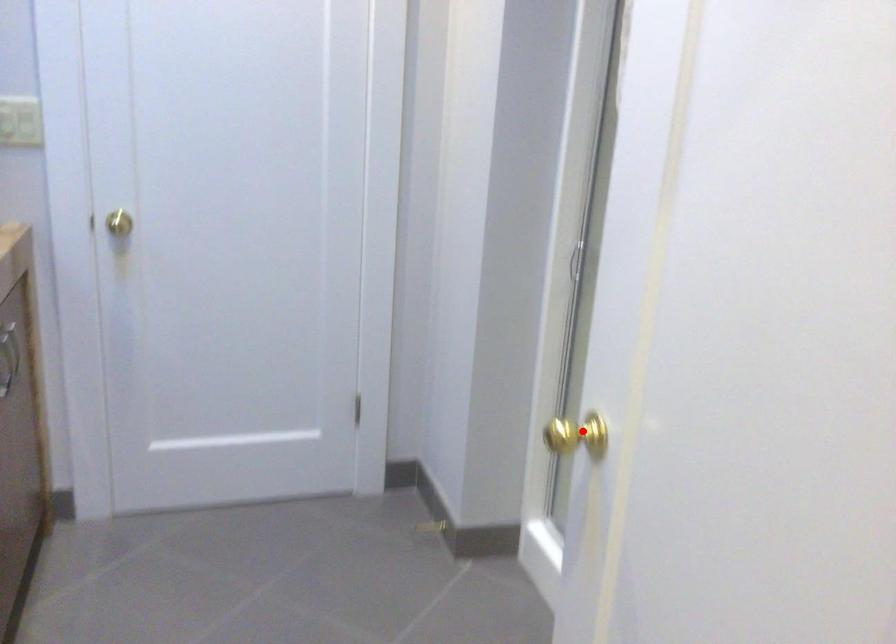
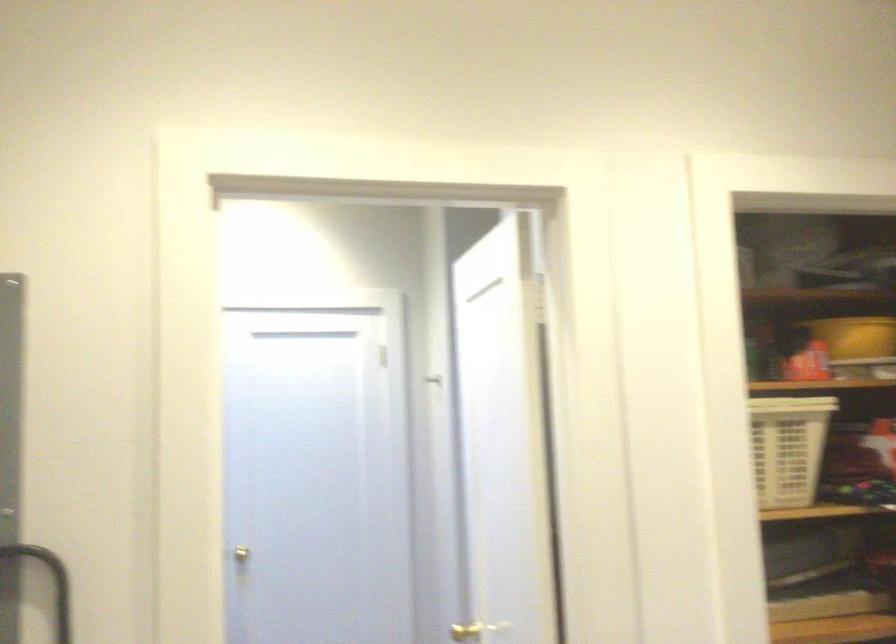
Question: A red point is marked in image1. In image2, is the corresponding 3D point closer to the camera or farther? Reply with the corresponding letter.

Choices:
 (A) The corresponding 3D point is closer.
 (B) The corresponding 3D point is farther.

Answer: (B)